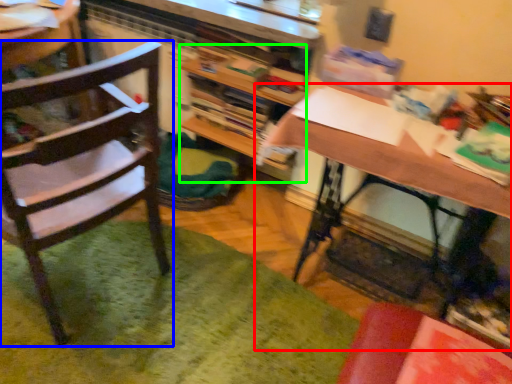
Question: Which object is positioned closest to desk (highlighted by a red box)? Select from chair (highlighted by a blue box) and bookshelf (highlighted by a green box).

Choices:
 (A) chair
 (B) bookshelf

Answer: (B)